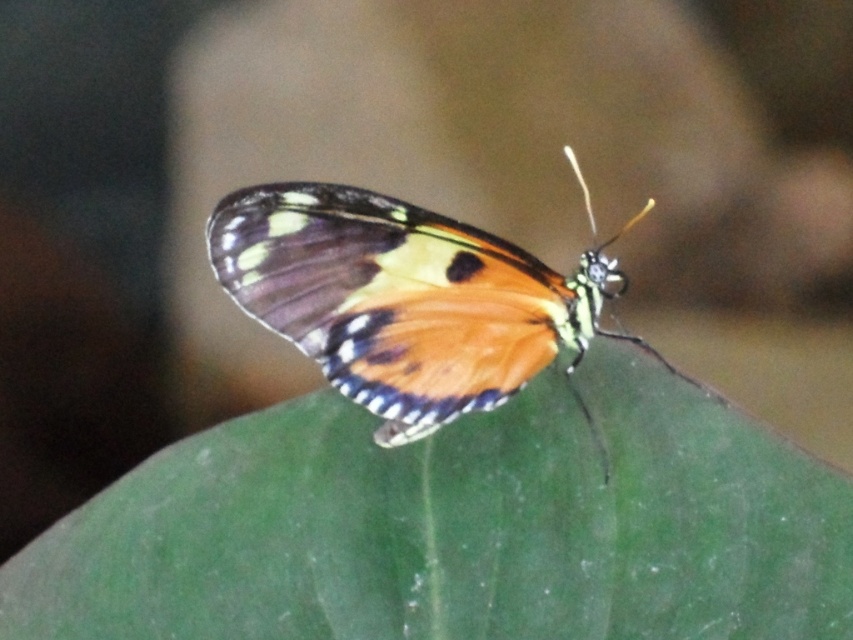
You are an entomologist observing this butterfly. You need to determine if the green matte leaf at center can fully cover the shiny orange butterfly at center when placed directly underneath. Based on their sizes, can it?

The green matte leaf at center is not as tall as the shiny orange butterfly at center, so it cannot fully cover the butterfly.

You are an entomologist observing a butterfly on a leaf. You need to determine if the leaf can support the butterfly without bending. Given that the leaf is green matte leaf at center and the butterfly is shiny orange butterfly at center, which object has a larger surface area to potentially support the weight?

The green matte leaf at center has a larger surface area than the shiny orange butterfly at center, so it can support the butterfly without bending.